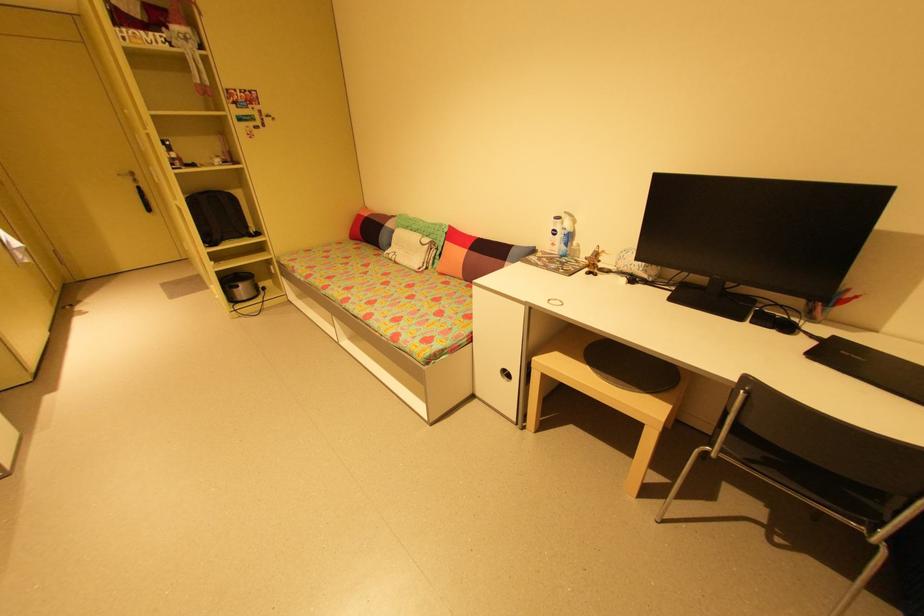
What do you see at coordinates (142, 198) in the screenshot?
I see `a black door handle` at bounding box center [142, 198].